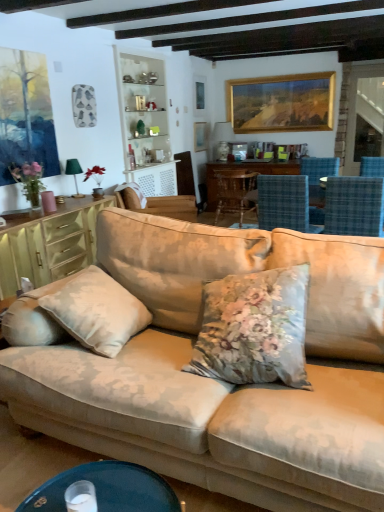
Question: Can you confirm if gold-framed painting at upper center, which is counted as the 2th picture frame, starting from the left, is thinner than pink matte vase at left?

Choices:
 (A) no
 (B) yes

Answer: (B)

Question: Is gold-framed painting at upper center, which is the 1th picture frame from right to left, not near pink matte vase at left?

Choices:
 (A) yes
 (B) no

Answer: (A)

Question: Can you confirm if gold-framed painting at upper center, which is counted as the 2th picture frame, starting from the left, is taller than pink matte vase at left?

Choices:
 (A) yes
 (B) no

Answer: (A)

Question: Is pink matte vase at left at the back of gold-framed painting at upper center, which is counted as the 2th picture frame, starting from the left?

Choices:
 (A) no
 (B) yes

Answer: (A)

Question: Considering the relative sizes of gold-framed painting at upper center, which is counted as the 2th picture frame, starting from the left, and pink matte vase at left in the image provided, is gold-framed painting at upper center, which is counted as the 2th picture frame, starting from the left, wider than pink matte vase at left?

Choices:
 (A) yes
 (B) no

Answer: (B)

Question: Considering the relative positions of gold-framed painting at upper center, which is counted as the 2th picture frame, starting from the left, and pink matte vase at left in the image provided, is gold-framed painting at upper center, which is counted as the 2th picture frame, starting from the left, behind pink matte vase at left?

Choices:
 (A) no
 (B) yes

Answer: (B)

Question: Could you tell me if gold-framed painting at upper center, which is the 1th picture frame from right to left, is turned towards beige fabric couch at center?

Choices:
 (A) no
 (B) yes

Answer: (B)

Question: Can you confirm if gold-framed painting at upper center, which is the 1th picture frame from right to left, is smaller than beige fabric couch at center?

Choices:
 (A) no
 (B) yes

Answer: (B)

Question: Does gold-framed painting at upper center, which is counted as the 2th picture frame, starting from the left, come behind beige fabric couch at center?

Choices:
 (A) no
 (B) yes

Answer: (B)

Question: From a real-world perspective, is gold-framed painting at upper center, which is the 1th picture frame from right to left, over beige fabric couch at center?

Choices:
 (A) no
 (B) yes

Answer: (B)

Question: Can you confirm if gold-framed painting at upper center, which is the 1th picture frame from right to left, is wider than beige fabric couch at center?

Choices:
 (A) no
 (B) yes

Answer: (A)

Question: From a real-world perspective, is gold-framed painting at upper center, which is the 1th picture frame from right to left, physically below beige fabric couch at center?

Choices:
 (A) yes
 (B) no

Answer: (B)

Question: Can you confirm if wooden chair at center, which is the 1th chair from back to front, is shorter than matte green cabinet at left?

Choices:
 (A) no
 (B) yes

Answer: (A)